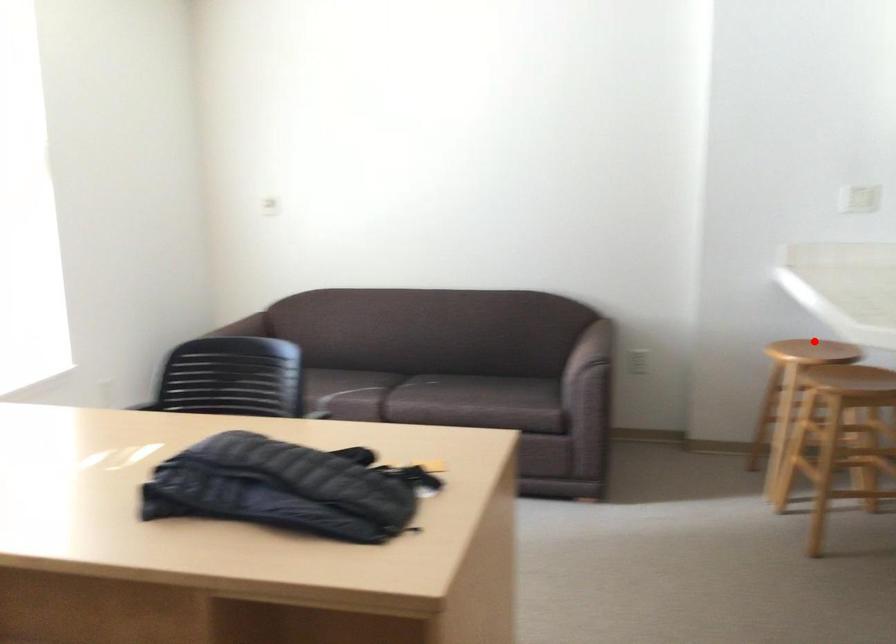
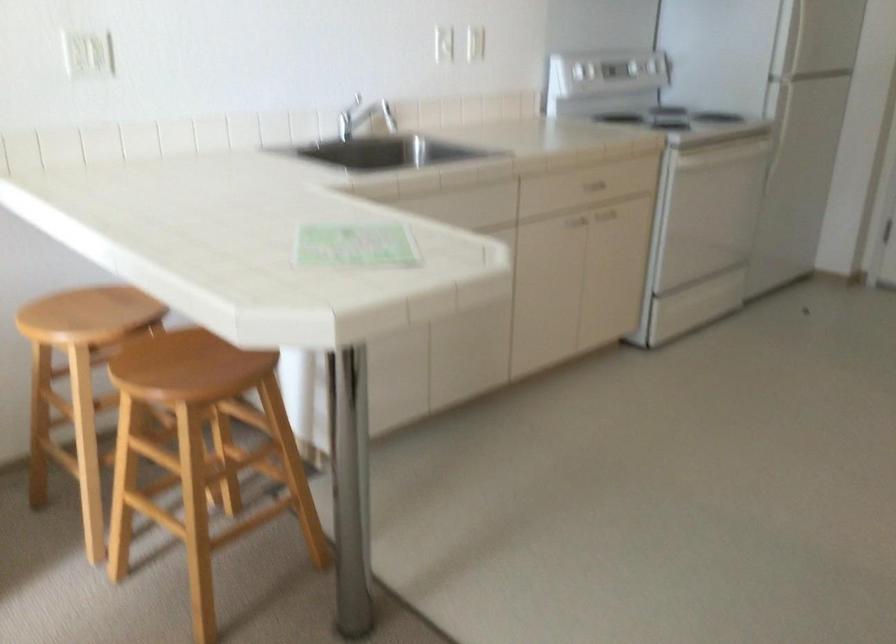
Question: I am providing you with two images of the same scene from different viewpoints. A red point is shown in image1. For the corresponding object point in image2, is it positioned nearer or farther from the camera?

Choices:
 (A) Nearer
 (B) Farther

Answer: (A)